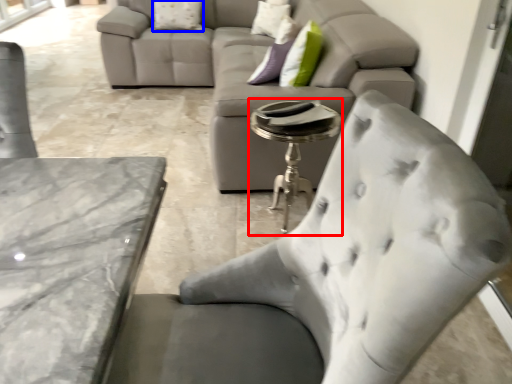
Question: Among these objects, which one is nearest to the camera, side table (highlighted by a red box) or pillow (highlighted by a blue box)?

Choices:
 (A) side table
 (B) pillow

Answer: (A)